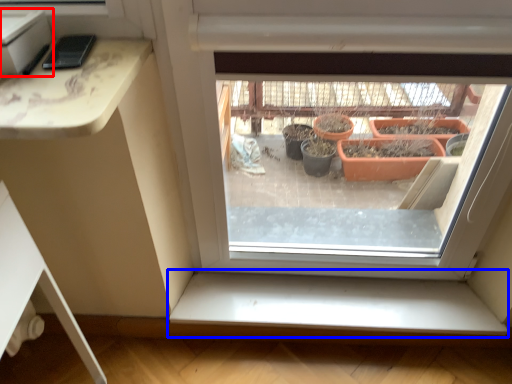
Question: Which point is closer to the camera, window box (highlighted by a red box) or window sill (highlighted by a blue box)?

Choices:
 (A) window box
 (B) window sill

Answer: (A)